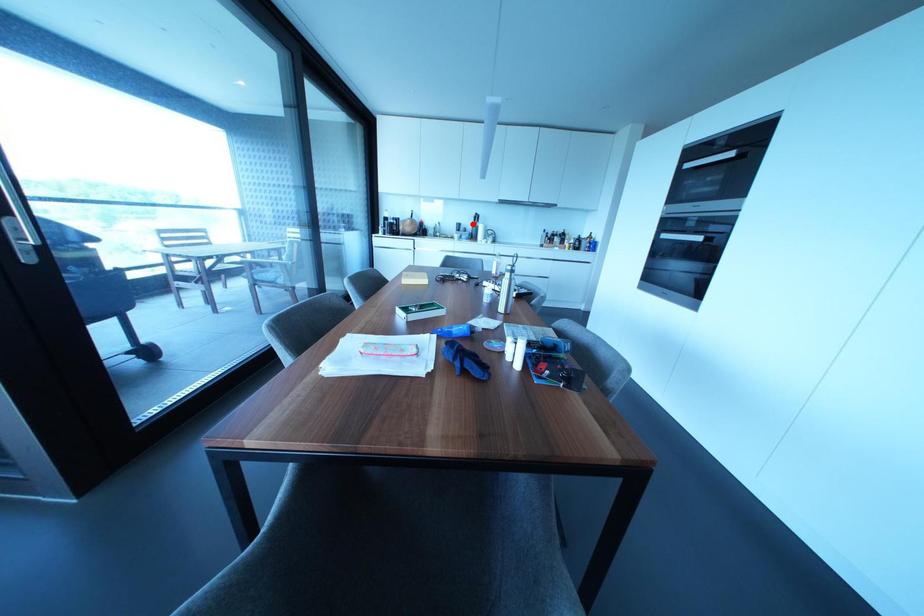
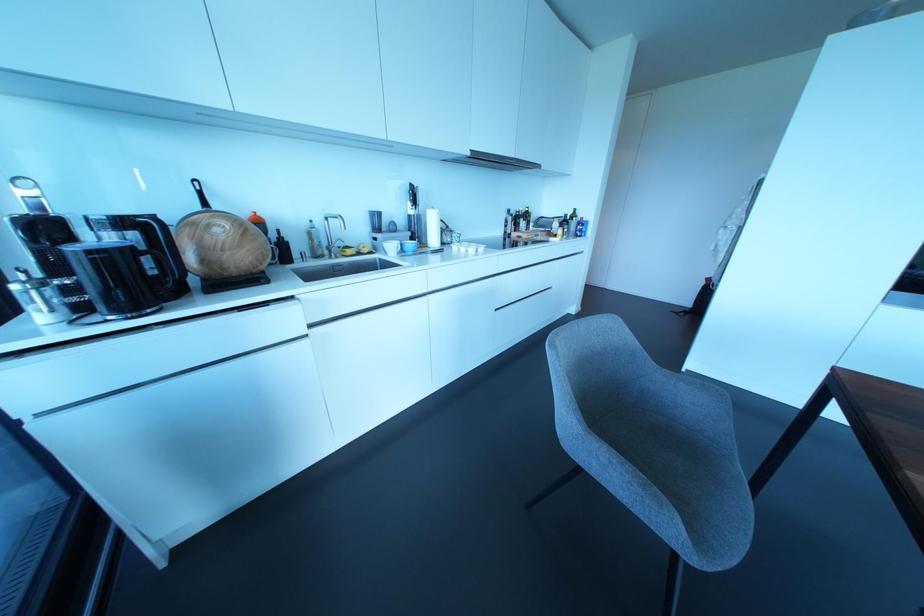
Locate, in the second image, the point that corresponds to the highlighted location in the first image.

(410, 211)